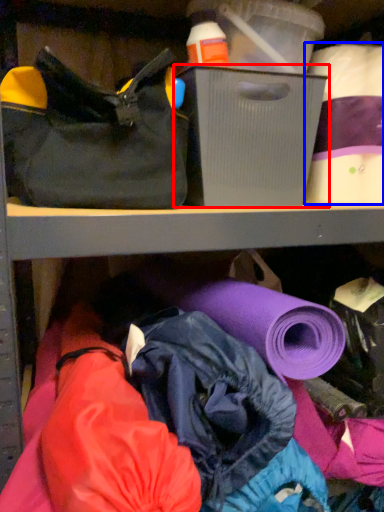
Question: Which object is further to the camera taking this photo, storage box (highlighted by a red box) or toilet paper (highlighted by a blue box)?

Choices:
 (A) storage box
 (B) toilet paper

Answer: (B)